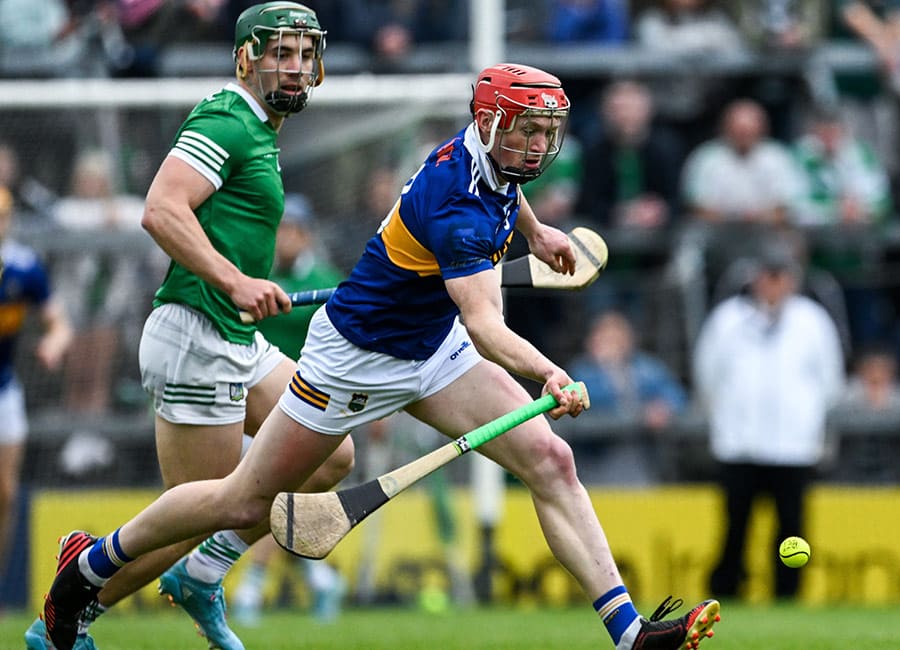
Image resolution: width=900 pixels, height=650 pixels. I want to click on handle, so click(545, 402), click(315, 294).